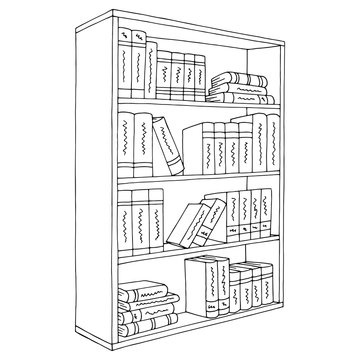
At what (x,y) coordinates should I click in order to perform the action: click on fourth shelf from the top books. Please return your answer as a coordinate pair (x, y). This screenshot has width=360, height=360. Looking at the image, I should click on (143, 295), (145, 303), (147, 309), (154, 324), (206, 297), (222, 289), (237, 295), (246, 293), (255, 290), (270, 287).